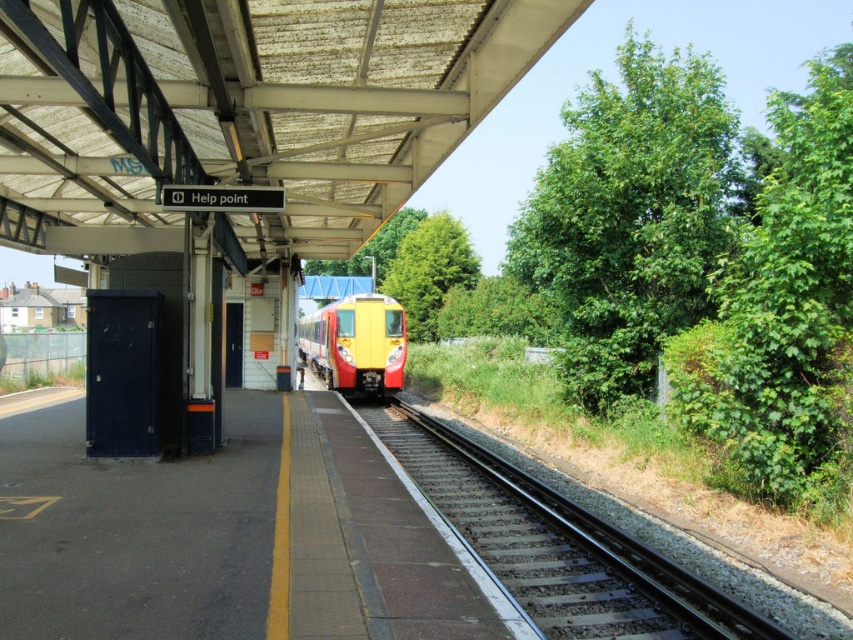
Who is more distant from viewer, (421, 472) or (343, 378)?

The point (343, 378) is behind.

Between smooth metal train track at center and yellow matte train at center, which one has less height?

Standing shorter between the two is smooth metal train track at center.

Find the location of `smooth metal train track at center`. smooth metal train track at center is located at coordinates (558, 545).